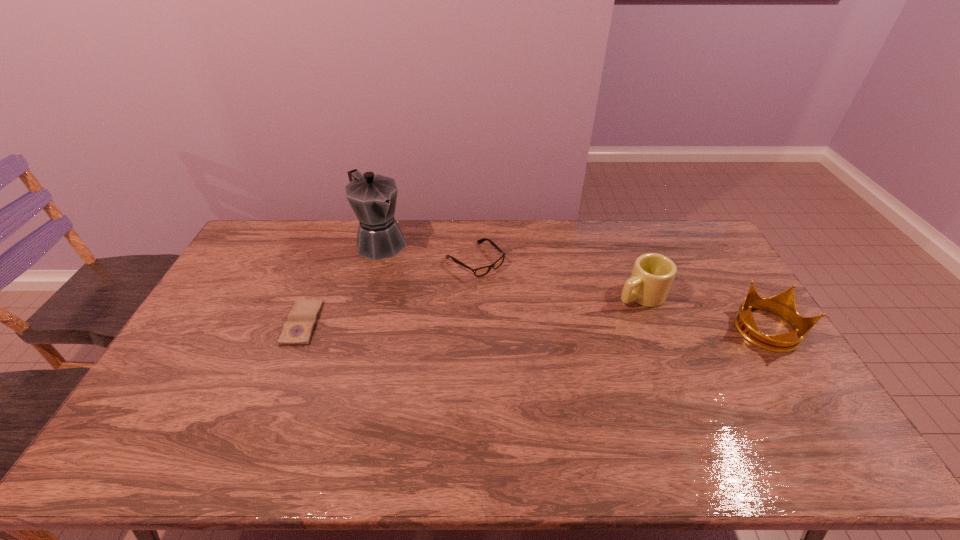
What are the coordinates of `free point that satisfies the following two spatial constraints: 1. on the back side of the second object from left to right; 2. on the left side of the leftmost object` in the screenshot? It's located at (335, 242).

Find the location of a particular element. The height and width of the screenshot is (540, 960). vacant area that satisfies the following two spatial constraints: 1. on the front side of the crown; 2. on the right side of the spectacles is located at coordinates (474, 330).